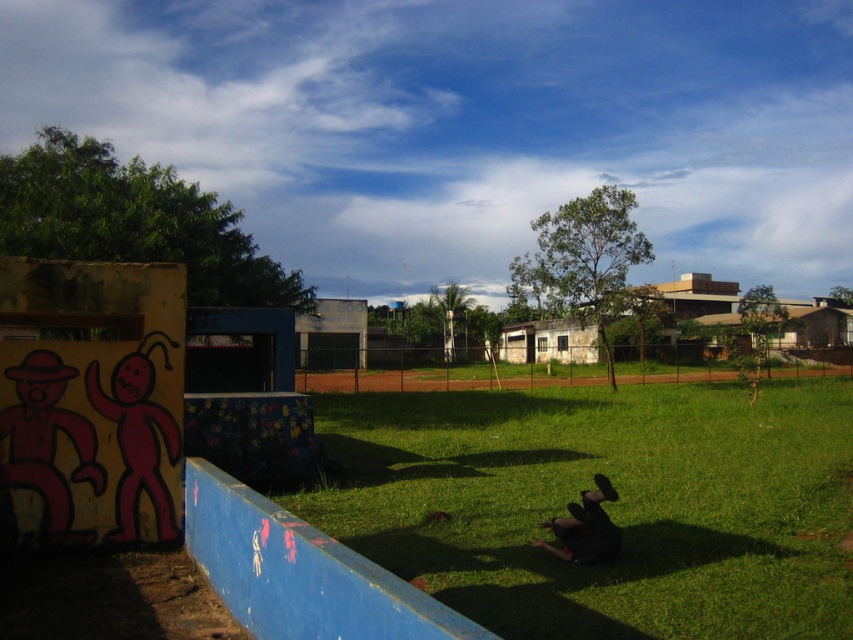
In the scene shown: You are standing in the outdoor scene and want to walk from the matte red figure at lower left to the green grass at center. Which direction should you move?

You should move to the right to reach the green grass at center from the matte red figure at lower left since the green grass at center is located to the right of the matte red figure at lower left.